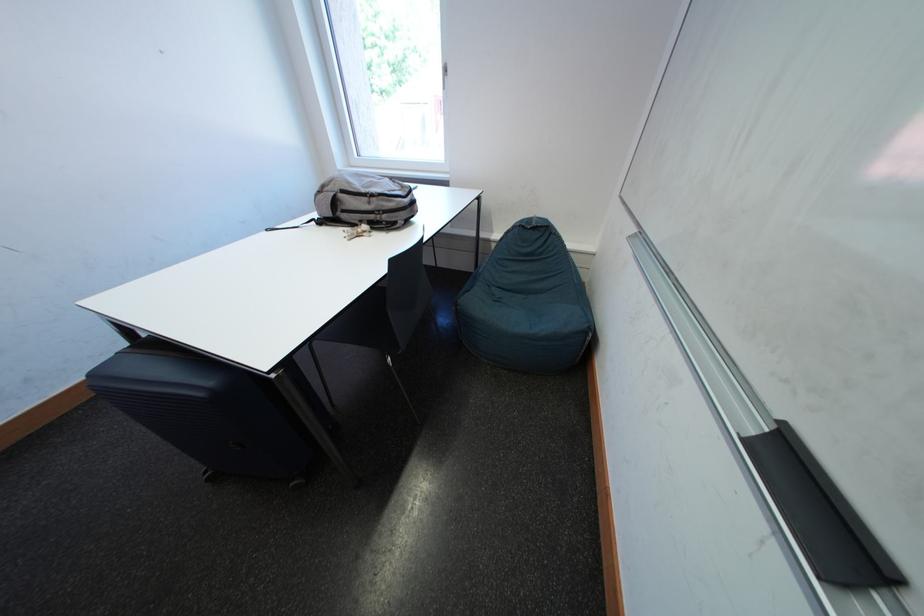
The location [358,232] corresponds to which object?

It corresponds to the set of keys in the image.